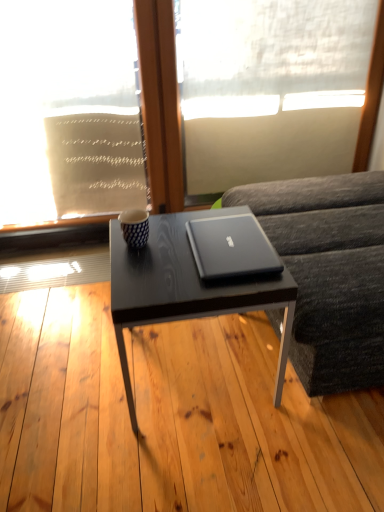
The height and width of the screenshot is (512, 384). What are the coordinates of `free space in front of blue and white textured mug at center` in the screenshot? It's located at (143, 265).